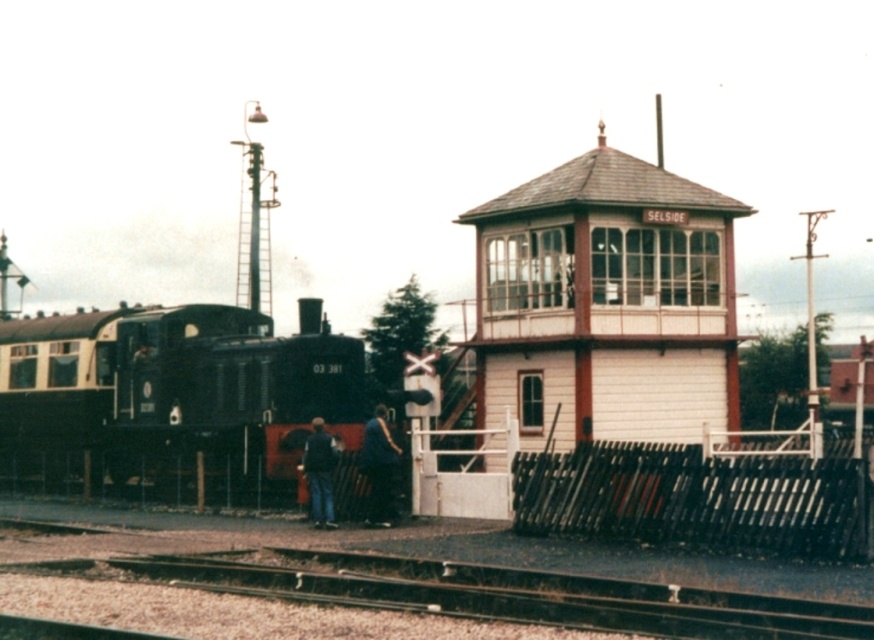
Consider the image. Is white wooden signal box at center to the left of dark blue jeans at center from the viewer's perspective?

No, white wooden signal box at center is not to the left of dark blue jeans at center.

Image resolution: width=874 pixels, height=640 pixels. Find the location of `white wooden signal box at center`. white wooden signal box at center is located at coordinates (591, 321).

The height and width of the screenshot is (640, 874). Describe the element at coordinates (591, 321) in the screenshot. I see `white wooden signal box at center` at that location.

In order to click on white wooden signal box at center in this screenshot , I will do tap(591, 321).

Who is more forward, (609,400) or (392,440)?

Point (392,440) is more forward.

Which of these two, white wooden signal box at center or dark blue shirt at center, stands shorter?

Standing shorter between the two is dark blue shirt at center.

Between point (503, 324) and point (394, 465), which one is positioned behind?

Positioned behind is point (503, 324).

Where is `white wooden signal box at center`? The height and width of the screenshot is (640, 874). white wooden signal box at center is located at coordinates (591, 321).

Measure the distance from white wooden signal box at center to matte black locomotive at left.

26.74 feet

Can you confirm if white wooden signal box at center is thinner than matte black locomotive at left?

No.

Where is `white wooden signal box at center`? white wooden signal box at center is located at coordinates (591, 321).